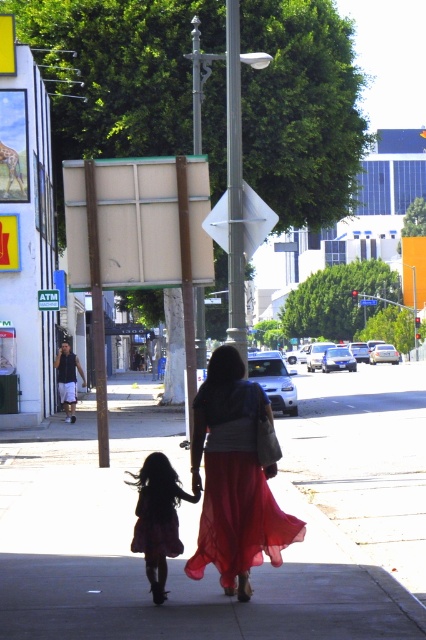
Question: Which of the following is the farthest from the observer?

Choices:
 (A) (400, 586)
 (B) (164, 499)
 (C) (219, 480)

Answer: (A)

Question: Which object is closer to the camera taking this photo?

Choices:
 (A) red chiffon dress at center
 (B) silky purple dress at lower left

Answer: (A)

Question: Can you confirm if smooth concrete sidewalk at center is positioned above red chiffon dress at center?

Choices:
 (A) yes
 (B) no

Answer: (B)

Question: Which of the following is the closest to the observer?

Choices:
 (A) smooth concrete sidewalk at center
 (B) silky purple dress at lower left
 (C) red chiffon dress at center

Answer: (A)

Question: From the image, what is the correct spatial relationship of smooth concrete sidewalk at center in relation to silky purple dress at lower left?

Choices:
 (A) left
 (B) right

Answer: (B)

Question: Can you confirm if smooth concrete sidewalk at center is positioned to the right of silky purple dress at lower left?

Choices:
 (A) no
 (B) yes

Answer: (B)